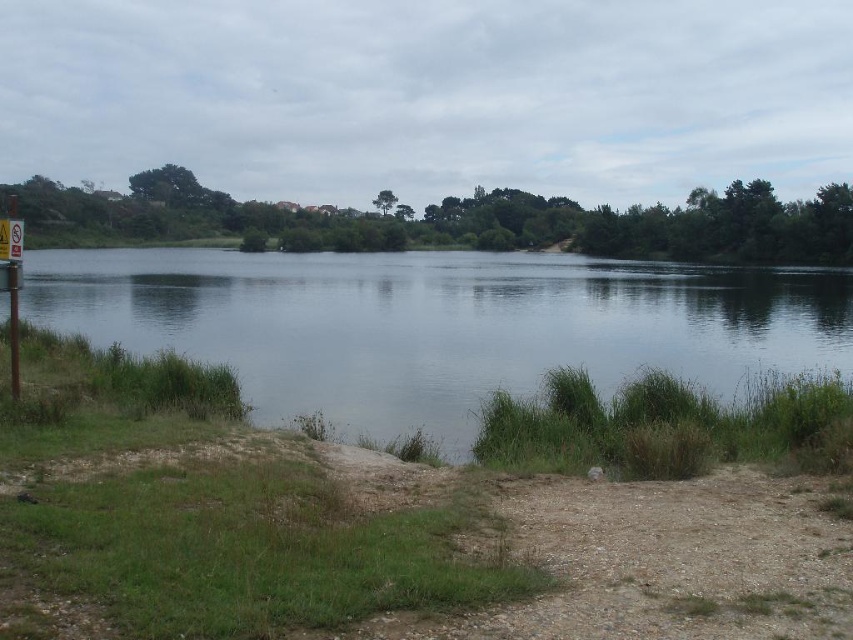
Which is more to the right, clear water at center or metal sign at left?

From the viewer's perspective, metal sign at left appears more on the right side.

Between clear water at center and metal sign at left, which one appears on the left side from the viewer's perspective?

Positioned to the left is clear water at center.

Describe the element at coordinates (440, 324) in the screenshot. I see `clear water at center` at that location.

You are a GUI agent. You are given a task and a screenshot of the screen. Output one action in this format:
    pyautogui.click(x=<x>, y=<y>)
    Task: Click on the clear water at center
    
    Given the screenshot: What is the action you would take?
    pyautogui.click(x=440, y=324)